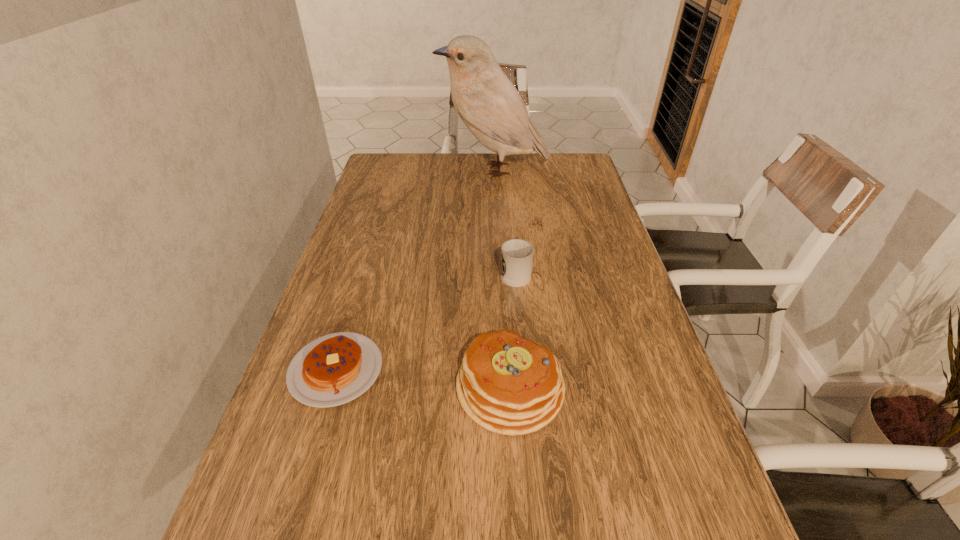
Where is `the farthest object`? Image resolution: width=960 pixels, height=540 pixels. the farthest object is located at coordinates (491, 107).

Identify the location of the tallest object. This screenshot has width=960, height=540. pyautogui.click(x=491, y=107).

Locate an element on the screen. This screenshot has height=540, width=960. the taller pancake is located at coordinates (509, 385).

This screenshot has height=540, width=960. Identify the location of cup. (516, 255).

Locate an element on the screen. the second farthest object is located at coordinates (516, 255).

The height and width of the screenshot is (540, 960). What are the coordinates of `the shorter pancake` in the screenshot? It's located at (334, 369).

Locate an element on the screen. This screenshot has width=960, height=540. the left pancake is located at coordinates coord(334,369).

The height and width of the screenshot is (540, 960). Identify the location of free point located on the face of the parakeet. (411, 170).

Where is `vacant space situated 0.160m on the face of the parakeet`? The width and height of the screenshot is (960, 540). vacant space situated 0.160m on the face of the parakeet is located at coordinates (395, 170).

Identify the location of vacant space located on the face of the parakeet. Image resolution: width=960 pixels, height=540 pixels. (414, 170).